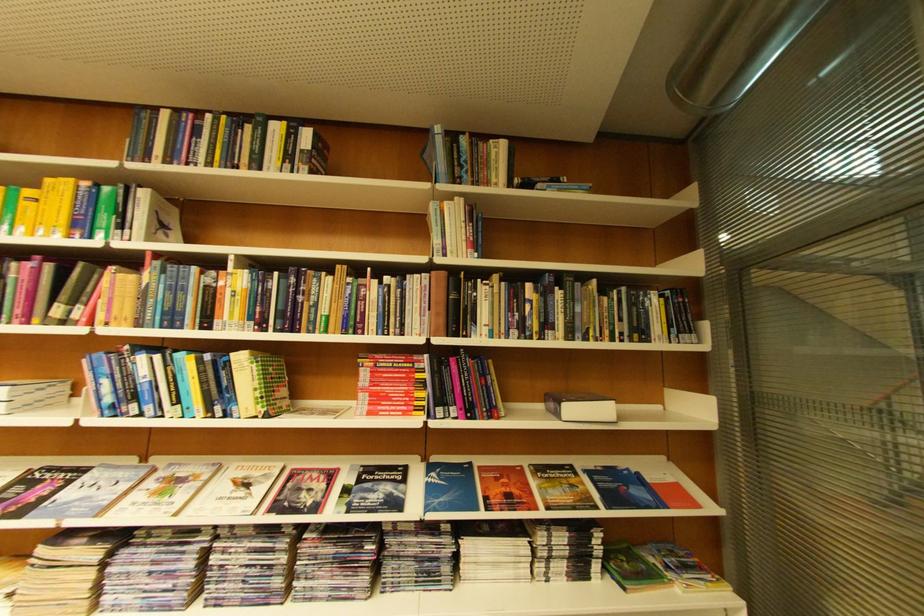
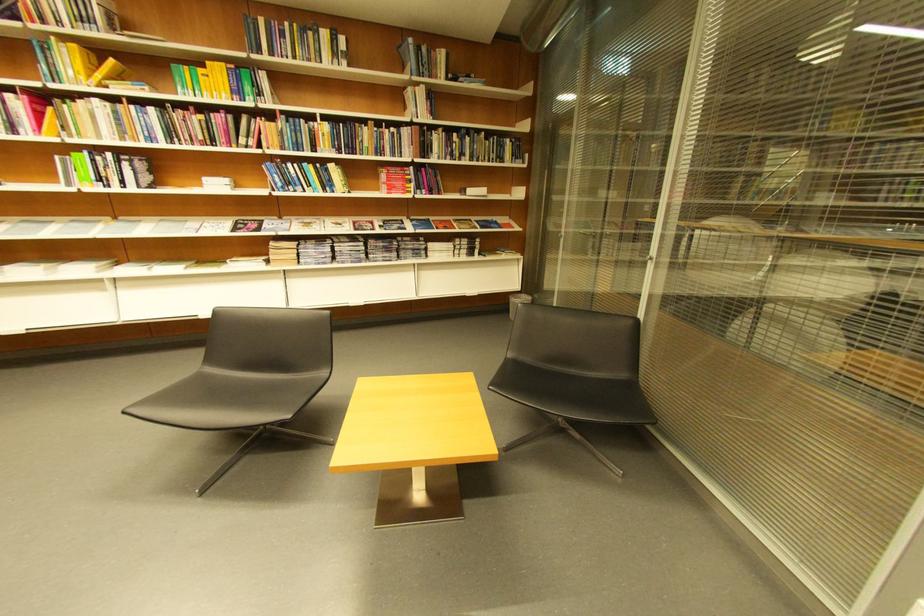
Where in the second image is the point corresponding to [444,209] from the first image?

(419, 91)